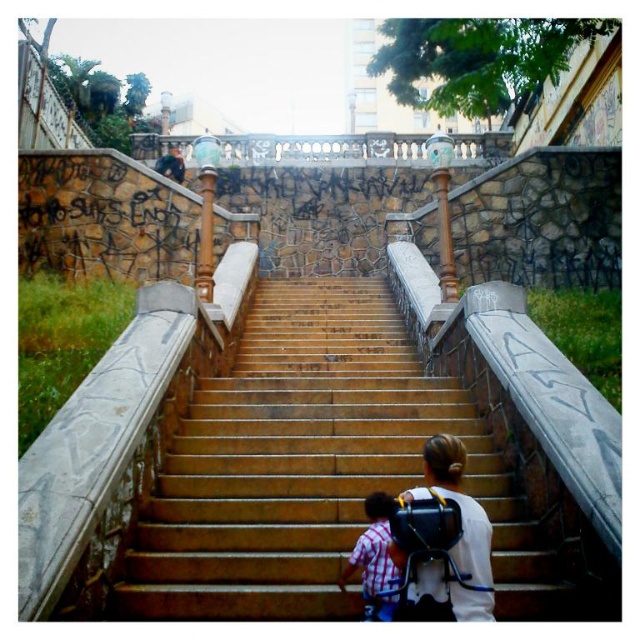
Question: Which point is closer to the camera?

Choices:
 (A) (436, 477)
 (B) (380, 596)
 (C) (440, 413)

Answer: (B)

Question: Which object appears farthest from the camera in this image?

Choices:
 (A) white matte backpack at center
 (B) brown polished stone stairs at center
 (C) plaid shirt at lower center

Answer: (B)

Question: Is brown polished stone stairs at center in front of plaid shirt at lower center?

Choices:
 (A) no
 (B) yes

Answer: (A)

Question: Can you confirm if white matte backpack at center is positioned below plaid shirt at lower center?

Choices:
 (A) no
 (B) yes

Answer: (A)

Question: Among these objects, which one is farthest from the camera?

Choices:
 (A) plaid shirt at lower center
 (B) white matte backpack at center

Answer: (A)

Question: Is brown polished stone stairs at center below white matte backpack at center?

Choices:
 (A) no
 (B) yes

Answer: (A)